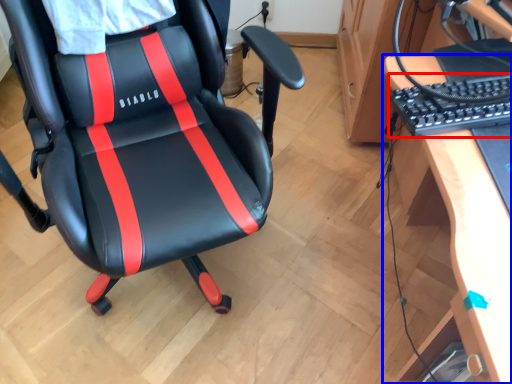
Question: Which object is further to the camera taking this photo, computer keyboard (highlighted by a red box) or desk (highlighted by a blue box)?

Choices:
 (A) computer keyboard
 (B) desk

Answer: (A)